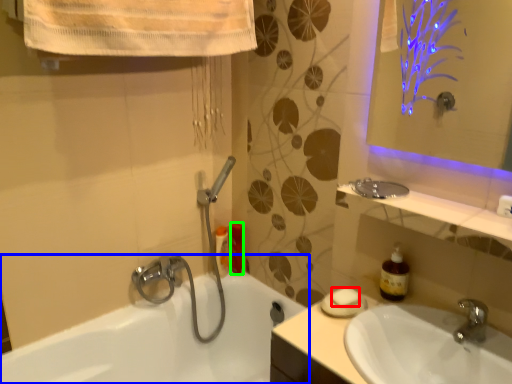
Question: Which is nearer to the soap (highlighted by a red box)? bathtub (highlighted by a blue box) or toiletry (highlighted by a green box).

Choices:
 (A) bathtub
 (B) toiletry

Answer: (B)